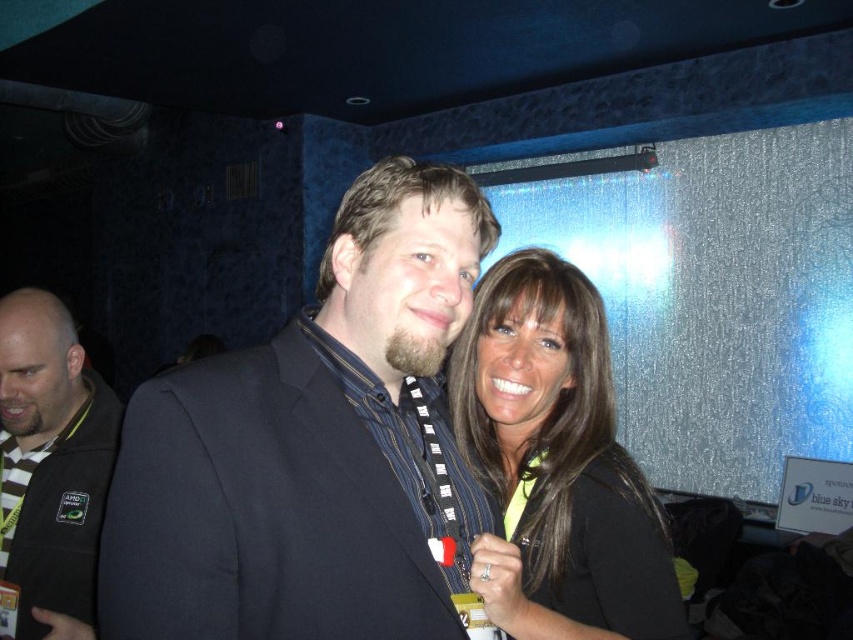
You are a photographer setting up a camera at a conference. You notice two items, the matte black suit at center and the matte black shirt at center, in your frame. The camera has a minimum focus distance of 8 inches. Will you be able to focus on both items without moving the camera?

The matte black suit at center and matte black shirt at center are 7.75 inches apart. Since the camera has a minimum focus distance of 8 inches, the distance between them is less than the required focus distance, so the camera cannot focus on both items simultaneously without moving the camera.

What object is located at the coordinates point (x=556, y=461) in the image?

The point (x=556, y=461) corresponds to the matte black shirt at center.

You are organizing a charity event and need to arrange two items on a table. You have a matte black shirt at center and a dark gray jacket at left. Based on their sizes, which item should you place first to ensure they fit properly?

The matte black shirt at center is smaller than the dark gray jacket at left, so you should place the dark gray jacket at left first to accommodate its larger size before placing the smaller matte black shirt at center.